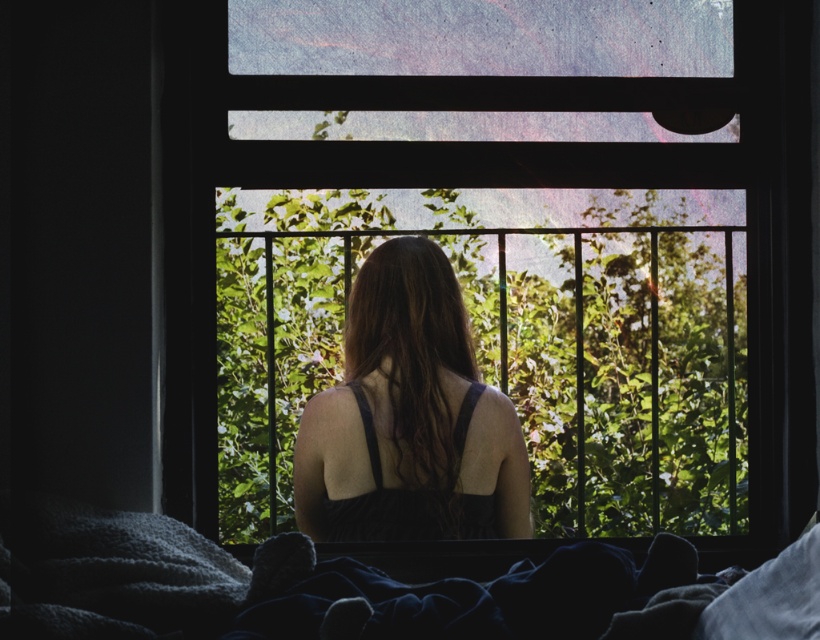
Question: Which is nearer to the soft woolen blanket at lower left?

Choices:
 (A) transparent glass window at center
 (B) matte black dress at center

Answer: (B)

Question: Based on their relative distances, which object is farther from the soft woolen blanket at lower left?

Choices:
 (A) matte black dress at center
 (B) transparent glass window at center

Answer: (B)

Question: Does soft woolen blanket at lower left have a lesser width compared to matte black dress at center?

Choices:
 (A) yes
 (B) no

Answer: (B)

Question: Which object is the farthest from the soft woolen blanket at lower left?

Choices:
 (A) matte black dress at center
 (B) transparent glass window at center

Answer: (B)

Question: Can you confirm if soft woolen blanket at lower left is positioned to the right of matte black dress at center?

Choices:
 (A) no
 (B) yes

Answer: (A)

Question: Considering the relative positions of transparent glass window at center and matte black dress at center in the image provided, where is transparent glass window at center located with respect to matte black dress at center?

Choices:
 (A) below
 (B) above

Answer: (B)